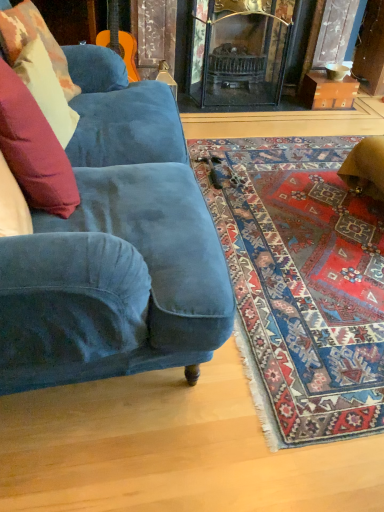
Where is `vacant area that is situated to the right of brown cardboard box at upper right`? vacant area that is situated to the right of brown cardboard box at upper right is located at coordinates (363, 108).